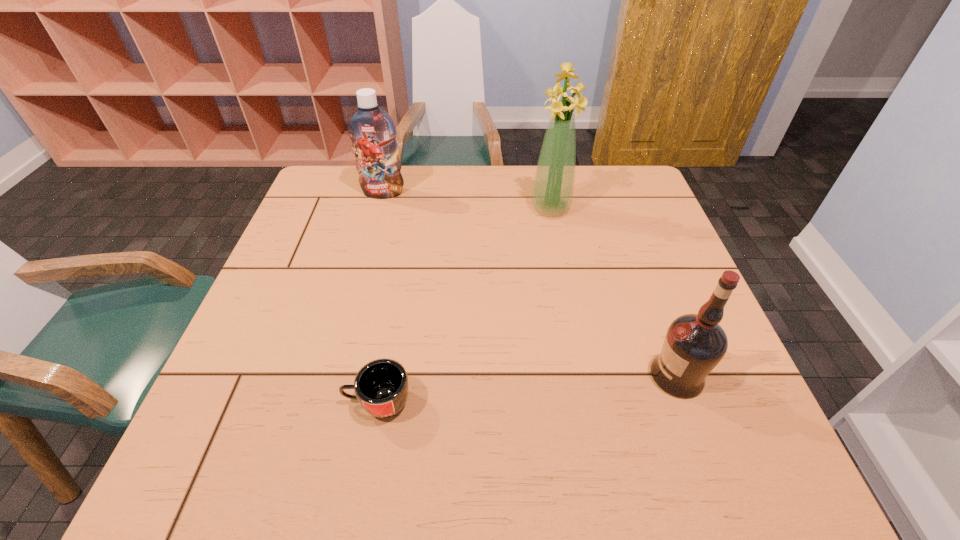
Locate an element on the screen. Image resolution: width=960 pixels, height=540 pixels. vacant space located 0.080m on the side of the shortest object with the handle is located at coordinates (302, 402).

The width and height of the screenshot is (960, 540). Identify the location of vacant space situated 0.060m on the side of the shortest object with the handle. (313, 402).

Where is `free space located on the side of the shortest object with the handle`? The height and width of the screenshot is (540, 960). free space located on the side of the shortest object with the handle is located at coordinates (276, 402).

Where is `bouquet that is positioned at the far edge`? bouquet that is positioned at the far edge is located at coordinates click(553, 186).

I want to click on shampoo at the far edge, so click(x=372, y=131).

Locate an element on the screen. This screenshot has width=960, height=540. object at the left edge is located at coordinates (372, 131).

Where is `object that is at the right edge`? This screenshot has height=540, width=960. object that is at the right edge is located at coordinates (694, 344).

Find the location of a particular element. This screenshot has height=540, width=960. object located in the far left corner section of the desktop is located at coordinates (372, 131).

The width and height of the screenshot is (960, 540). In the image, there is a desktop. Find the location of `blank space at the far edge`. blank space at the far edge is located at coordinates (386, 208).

I want to click on vacant space at the near edge of the desktop, so click(x=642, y=446).